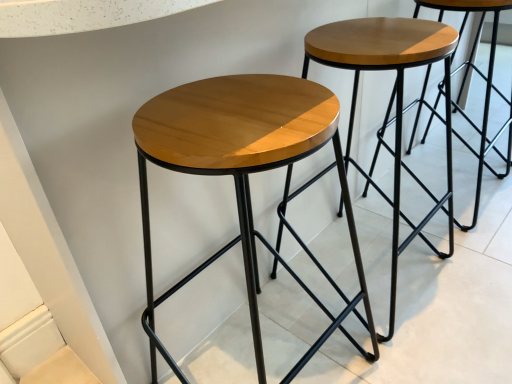
Question: In which direction should I rotate to look at shiny wood stool at center, acting as the second stool starting from the right?

Choices:
 (A) right
 (B) left

Answer: (A)

Question: Are shiny wood stool at center, acting as the second stool starting from the right, and wooden stool at center, placed as the first stool when sorted from right to left, far apart?

Choices:
 (A) no
 (B) yes

Answer: (A)

Question: Is shiny wood stool at center, which ranks as the 1th stool in left-to-right order, in front of wooden stool at center, placed as the first stool when sorted from right to left?

Choices:
 (A) no
 (B) yes

Answer: (B)

Question: Can you confirm if shiny wood stool at center, acting as the second stool starting from the right, is smaller than wooden stool at center, the 2th stool in the left-to-right sequence?

Choices:
 (A) no
 (B) yes

Answer: (A)

Question: Is shiny wood stool at center, which ranks as the 1th stool in left-to-right order, further to the viewer compared to wooden stool at center, placed as the first stool when sorted from right to left?

Choices:
 (A) no
 (B) yes

Answer: (A)

Question: From the image's perspective, is shiny wood stool at center, which ranks as the 1th stool in left-to-right order, above wooden stool at center, the 2th stool in the left-to-right sequence?

Choices:
 (A) no
 (B) yes

Answer: (A)

Question: From a real-world perspective, is shiny wood stool at center, which ranks as the 1th stool in left-to-right order, on wooden stool at center, placed as the first stool when sorted from right to left?

Choices:
 (A) yes
 (B) no

Answer: (A)

Question: Is wooden stool at center, placed as the first stool when sorted from right to left, wider than shiny wood stool at center, which ranks as the 1th stool in left-to-right order?

Choices:
 (A) yes
 (B) no

Answer: (B)

Question: Does wooden stool at center, the 2th stool in the left-to-right sequence, have a lesser height compared to shiny wood stool at center, which ranks as the 1th stool in left-to-right order?

Choices:
 (A) yes
 (B) no

Answer: (A)

Question: Can you confirm if wooden stool at center, placed as the first stool when sorted from right to left, is bigger than shiny wood stool at center, which ranks as the 1th stool in left-to-right order?

Choices:
 (A) yes
 (B) no

Answer: (B)

Question: From a real-world perspective, does wooden stool at center, placed as the first stool when sorted from right to left, stand above shiny wood stool at center, which ranks as the 1th stool in left-to-right order?

Choices:
 (A) yes
 (B) no

Answer: (B)

Question: From the image's perspective, is wooden stool at center, the 2th stool in the left-to-right sequence, on top of shiny wood stool at center, which ranks as the 1th stool in left-to-right order?

Choices:
 (A) no
 (B) yes

Answer: (B)

Question: Is wooden stool at center, placed as the first stool when sorted from right to left, looking in the opposite direction of shiny wood stool at center, acting as the second stool starting from the right?

Choices:
 (A) yes
 (B) no

Answer: (B)

Question: In the image, is wooden stool at center, the 2th stool in the left-to-right sequence, on the left side or the right side of shiny wood stool at center, acting as the second stool starting from the right?

Choices:
 (A) right
 (B) left

Answer: (A)